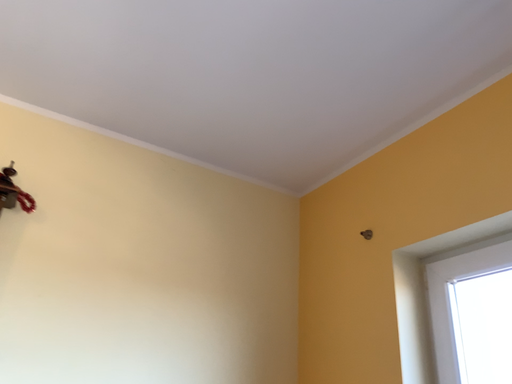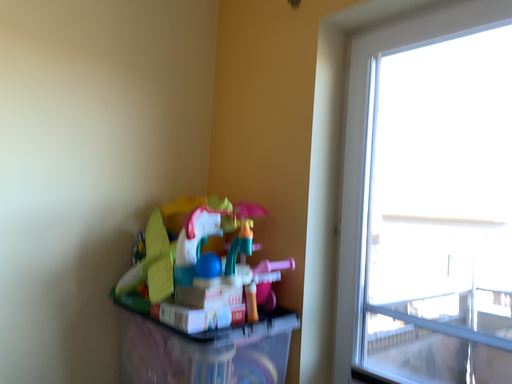
Question: Which way did the camera rotate in the video?

Choices:
 (A) rotated downward
 (B) rotated upward

Answer: (A)